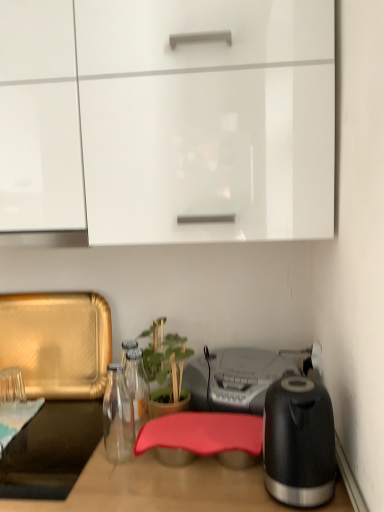
Measure the distance between black glossy electric kettle at right and camera.

33.09 inches.

Describe the element at coordinates (299, 442) in the screenshot. This screenshot has width=384, height=512. I see `black glossy electric kettle at right` at that location.

The height and width of the screenshot is (512, 384). What do you see at coordinates (166, 121) in the screenshot?
I see `white glossy cabinet at upper center` at bounding box center [166, 121].

From the picture: What is the approximate width of metallic silver radio at center?

metallic silver radio at center is 11.48 inches in width.

Where is `black glossy electric kettle at right`? black glossy electric kettle at right is located at coordinates (299, 442).

Is green matte plant at center at the left side of black glossy electric kettle at right?

Correct, you'll find green matte plant at center to the left of black glossy electric kettle at right.

Is green matte plant at center positioned with its back to black glossy electric kettle at right?

No.

You are a GUI agent. You are given a task and a screenshot of the screen. Output one action in this format:
    pyautogui.click(x=<x>, y=<y>)
    Task: Click on the kitchen appliance lying below the green matte plant at center (from the image's perspective)
    This screenshot has height=512, width=384.
    Given the screenshot: What is the action you would take?
    pyautogui.click(x=299, y=442)

From the image's perspective, is green matte plant at center below black glossy electric kettle at right?

No, from the image's perspective, green matte plant at center is not beneath black glossy electric kettle at right.

Considering the sizes of objects black glossy electric kettle at right and metallic silver radio at center in the image provided, who is thinner, black glossy electric kettle at right or metallic silver radio at center?

black glossy electric kettle at right is thinner.

Considering the sizes of objects black glossy electric kettle at right and metallic silver radio at center in the image provided, who is bigger, black glossy electric kettle at right or metallic silver radio at center?

metallic silver radio at center is bigger.

Is black glossy electric kettle at right next to metallic silver radio at center?

There is a gap between black glossy electric kettle at right and metallic silver radio at center.

Is black glossy electric kettle at right facing away from metallic silver radio at center?

No, black glossy electric kettle at right's orientation is not away from metallic silver radio at center.

From the image's perspective, which is above, metallic silver radio at center or green matte plant at center?

green matte plant at center, from the image's perspective.

How much distance is there between metallic silver radio at center and green matte plant at center?

metallic silver radio at center is 15.63 centimeters from green matte plant at center.

How different are the orientations of metallic silver radio at center and green matte plant at center in degrees?

The angular difference between metallic silver radio at center and green matte plant at center is 4.8 degrees.

Between metallic silver radio at center and green matte plant at center, which one appears on the left side from the viewer's perspective?

green matte plant at center is more to the left.

Could you tell me if green matte plant at center is turned towards metallic silver radio at center?

No, green matte plant at center does not turn towards metallic silver radio at center.

Is green matte plant at center not close to metallic silver radio at center?

No, green matte plant at center is in close proximity to metallic silver radio at center.

From a real-world perspective, is green matte plant at center beneath metallic silver radio at center?

No, from a real-world perspective, green matte plant at center is not below metallic silver radio at center.

At what (x,y) coordinates should I click in order to perform the action: click on kitchen appliance in front of the white glossy cabinet at upper center. Please return your answer as a coordinate pair (x, y). The image size is (384, 512). Looking at the image, I should click on (299, 442).

How distant is black glossy electric kettle at right from white glossy cabinet at upper center?

They are 23.75 inches apart.

In terms of height, does black glossy electric kettle at right look taller or shorter compared to white glossy cabinet at upper center?

black glossy electric kettle at right is shorter than white glossy cabinet at upper center.

Is white glossy cabinet at upper center inside black glossy electric kettle at right?

Definitely not — white glossy cabinet at upper center is not inside black glossy electric kettle at right.

From the image's perspective, is green matte plant at center on white glossy cabinet at upper center?

Incorrect, from the image's perspective, green matte plant at center is lower than white glossy cabinet at upper center.

From the picture: Is green matte plant at center positioned far away from white glossy cabinet at upper center?

No, green matte plant at center is not far from white glossy cabinet at upper center.

In the scene shown: From a real-world perspective, between green matte plant at center and white glossy cabinet at upper center, who is vertically lower?

green matte plant at center, from a real-world perspective.

Which of these two, white glossy cabinet at upper center or green matte plant at center, is smaller?

Smaller between the two is green matte plant at center.

Is the depth of white glossy cabinet at upper center less than that of green matte plant at center?

Yes, the depth of white glossy cabinet at upper center is less than that of green matte plant at center.

Between white glossy cabinet at upper center and green matte plant at center, which one has more height?

white glossy cabinet at upper center.

From the image's perspective, is white glossy cabinet at upper center above green matte plant at center?

Correct, white glossy cabinet at upper center appears higher than green matte plant at center in the image.

Identify the location of houseplant below the black glossy electric kettle at right (from a real-world perspective). Image resolution: width=384 pixels, height=512 pixels. (166, 369).

This screenshot has width=384, height=512. I want to click on kitchen appliance on the right of metallic silver radio at center, so click(299, 442).

Estimate the real-world distances between objects in this image. Which object is closer to black glossy electric kettle at right, metallic silver radio at center or green matte plant at center?

Based on the image, metallic silver radio at center appears to be nearer to black glossy electric kettle at right.

Consider the image. Based on their spatial positions, is black glossy electric kettle at right or metallic silver radio at center further from green matte plant at center?

black glossy electric kettle at right.

Based on their spatial positions, is metallic silver radio at center or black glossy electric kettle at right closer to white glossy cabinet at upper center?

black glossy electric kettle at right lies closer to white glossy cabinet at upper center than the other object.

From the image, which object appears to be nearer to metallic silver radio at center, white glossy cabinet at upper center or black glossy electric kettle at right?

The object closer to metallic silver radio at center is black glossy electric kettle at right.

Looking at the image, which one is located further to white glossy cabinet at upper center, black glossy electric kettle at right or metallic silver radio at center?

Among the two, metallic silver radio at center is located further to white glossy cabinet at upper center.

From the image, which object appears to be farther from white glossy cabinet at upper center, metallic silver radio at center or green matte plant at center?

green matte plant at center lies further to white glossy cabinet at upper center than the other object.

Looking at the image, which one is located closer to green matte plant at center, white glossy cabinet at upper center or black glossy electric kettle at right?

black glossy electric kettle at right is closer to green matte plant at center.

Estimate the real-world distances between objects in this image. Which object is further from white glossy cabinet at upper center, green matte plant at center or black glossy electric kettle at right?

green matte plant at center.

Find the location of `appliance between white glossy cabinet at upper center and black glossy electric kettle at right in the up-down direction`. appliance between white glossy cabinet at upper center and black glossy electric kettle at right in the up-down direction is located at coordinates (243, 376).

At what (x,y) coordinates should I click in order to perform the action: click on houseplant between black glossy electric kettle at right and metallic silver radio at center along the z-axis. Please return your answer as a coordinate pair (x, y). The height and width of the screenshot is (512, 384). Looking at the image, I should click on (166, 369).

Identify the location of houseplant between white glossy cabinet at upper center and metallic silver radio at center in the up-down direction. Image resolution: width=384 pixels, height=512 pixels. (166, 369).

Where is `houseplant between white glossy cabinet at upper center and black glossy electric kettle at right in the vertical direction`? houseplant between white glossy cabinet at upper center and black glossy electric kettle at right in the vertical direction is located at coordinates (166, 369).